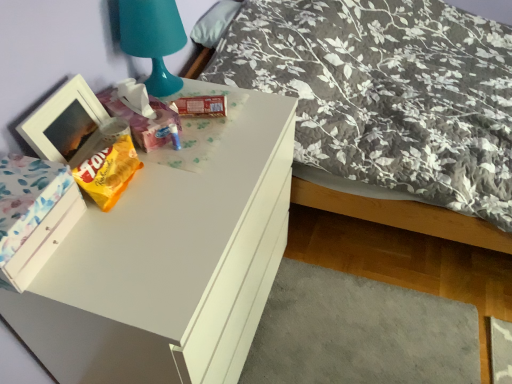
In order to click on vacant space behind matte brown package at upper center, which is the second package in left-to-right order in this screenshot , I will do `click(196, 89)`.